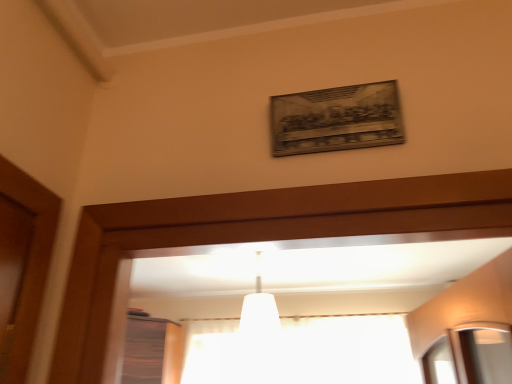
Question: Is white fabric curtain at center thinner than white matte lampshade at center?

Choices:
 (A) yes
 (B) no

Answer: (A)

Question: Does white fabric curtain at center have a lesser height compared to white matte lampshade at center?

Choices:
 (A) no
 (B) yes

Answer: (B)

Question: Can you confirm if white fabric curtain at center is wider than white matte lampshade at center?

Choices:
 (A) no
 (B) yes

Answer: (A)

Question: Are white fabric curtain at center and white matte lampshade at center beside each other?

Choices:
 (A) no
 (B) yes

Answer: (A)

Question: Is white fabric curtain at center in front of white matte lampshade at center?

Choices:
 (A) yes
 (B) no

Answer: (B)

Question: From the image's perspective, is white fabric curtain at center located above white matte lampshade at center?

Choices:
 (A) no
 (B) yes

Answer: (A)

Question: Considering the relative positions of white matte lampshade at center and white fabric curtain at center in the image provided, is white matte lampshade at center in front of white fabric curtain at center?

Choices:
 (A) no
 (B) yes

Answer: (B)

Question: Does white matte lampshade at center touch white fabric curtain at center?

Choices:
 (A) no
 (B) yes

Answer: (A)

Question: Is white matte lampshade at center oriented towards white fabric curtain at center?

Choices:
 (A) yes
 (B) no

Answer: (B)

Question: Does white matte lampshade at center appear on the right side of white fabric curtain at center?

Choices:
 (A) yes
 (B) no

Answer: (B)

Question: Can you confirm if white matte lampshade at center is smaller than white fabric curtain at center?

Choices:
 (A) no
 (B) yes

Answer: (B)

Question: Is white matte lampshade at center not close to white fabric curtain at center?

Choices:
 (A) yes
 (B) no

Answer: (A)

Question: Is white matte lampshade at center spatially inside white fabric curtain at center, or outside of it?

Choices:
 (A) outside
 (B) inside

Answer: (A)